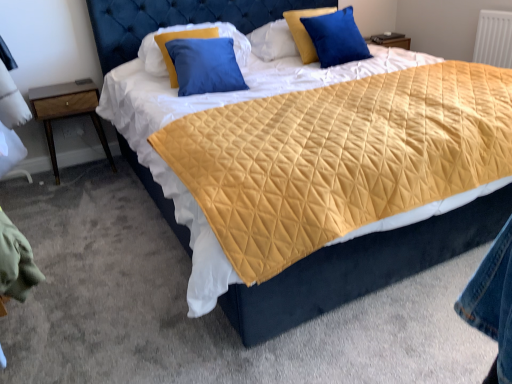
Question: Would you say blue satin pillow at upper right, the third pillow positioned from the left, is to the left or to the right of wooden nightstand at left in the picture?

Choices:
 (A) left
 (B) right

Answer: (B)

Question: Considering the positions of blue satin pillow at upper right, the third pillow positioned from the left, and wooden nightstand at left in the image, is blue satin pillow at upper right, the third pillow positioned from the left, wider or thinner than wooden nightstand at left?

Choices:
 (A) thin
 (B) wide

Answer: (A)

Question: Estimate the real-world distances between objects in this image. Which object is farther from the blue satin pillow at upper right, which ranks as the 1th pillow in right-to-left order?

Choices:
 (A) wooden nightstand at left
 (B) velvet blue pillow at upper center, the 2th pillow positioned from the left
 (C) blue velvet pillow at upper center, the 3th pillow in the right-to-left sequence

Answer: (A)

Question: Which object is positioned closest to the blue velvet pillow at upper center, arranged as the first pillow when viewed from the left?

Choices:
 (A) blue satin pillow at upper right, the third pillow positioned from the left
 (B) velvet blue pillow at upper center, the 2th pillow positioned from the left
 (C) wooden nightstand at left

Answer: (B)